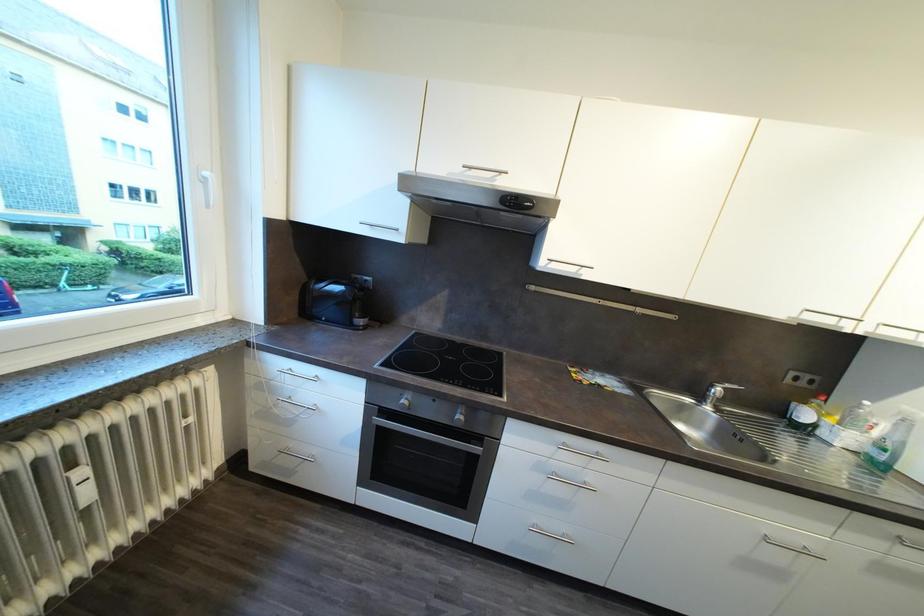
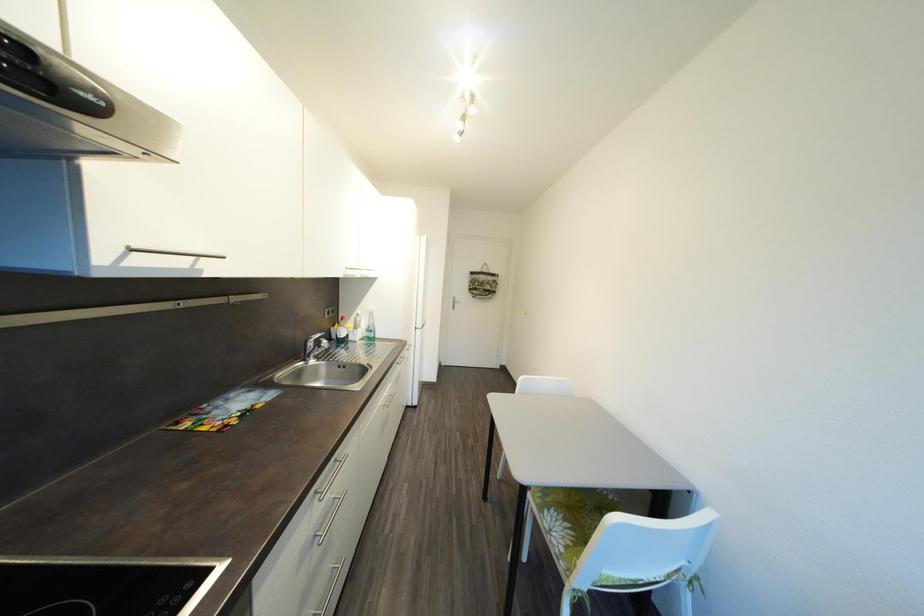
First-person continuous shooting, in which direction is the camera rotating?

The rotation direction of the camera is right-down.